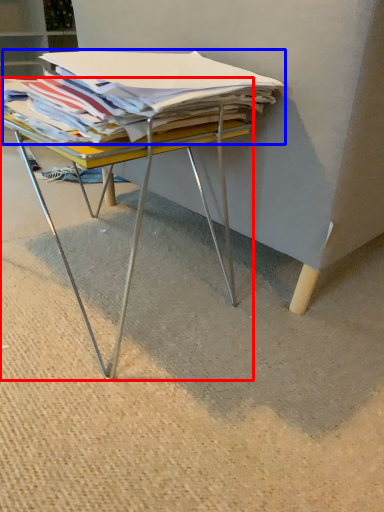
Question: Which point is closer to the camera, desk (highlighted by a red box) or magazine (highlighted by a blue box)?

Choices:
 (A) desk
 (B) magazine

Answer: (B)